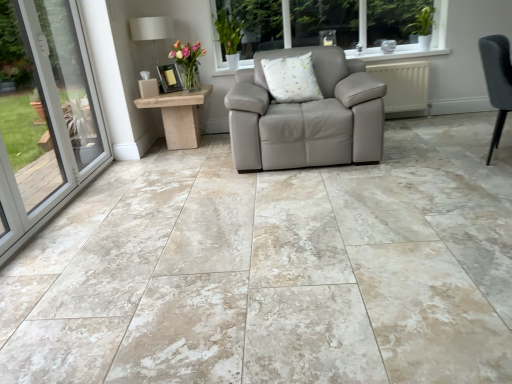
The image size is (512, 384). I want to click on vacant region below wooden side table at left (from a real-world perspective), so click(179, 150).